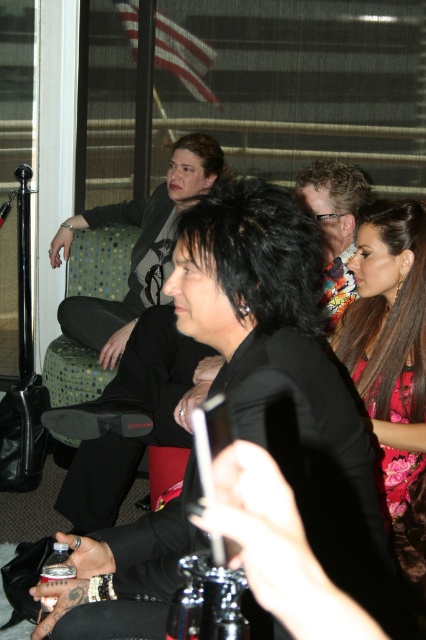
Is the position of matte black jacket at upper left less distant than that of multicolored fabric shirt at center?

No.

Who is taller, matte black jacket at upper left or multicolored fabric shirt at center?

Standing taller between the two is matte black jacket at upper left.

Is point (91, 308) positioned after point (347, 220)?

That is True.

Find the location of a particular element. The width and height of the screenshot is (426, 640). matte black jacket at upper left is located at coordinates (137, 248).

Is multicolored fabric shirt at center further to the viewer compared to metallic silver can at lower left?

That is True.

Does point (319, 180) come in front of point (54, 557)?

No.

The height and width of the screenshot is (640, 426). Identify the location of multicolored fabric shirt at center. (334, 227).

Where is `black satin jacket at center`? The image size is (426, 640). black satin jacket at center is located at coordinates (284, 372).

Who is more distant from viewer, [282,227] or [357,211]?

The point [357,211] is behind.

This screenshot has width=426, height=640. I want to click on black satin jacket at center, so click(284, 372).